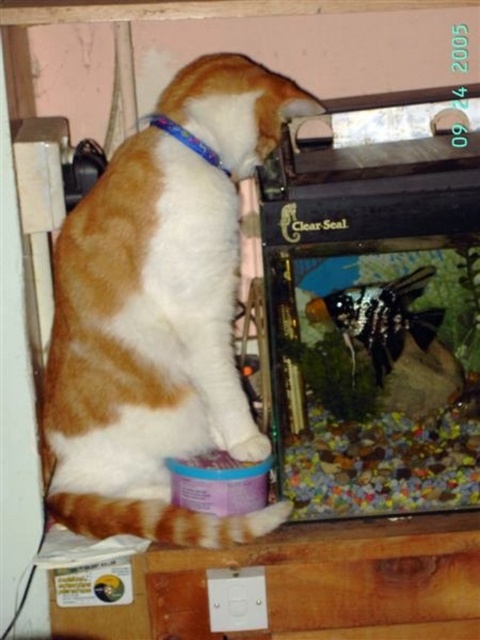
Question: Observing the image, what is the correct spatial positioning of orange and white fur cat at center in reference to black glossy fish at center?

Choices:
 (A) left
 (B) right

Answer: (A)

Question: Which point is farther to the camera?

Choices:
 (A) black glossy fish at center
 (B) orange and white fur cat at center

Answer: (A)

Question: Which point appears closest to the camera in this image?

Choices:
 (A) (115, 448)
 (B) (337, 292)

Answer: (A)

Question: Among these objects, which one is nearest to the camera?

Choices:
 (A) orange and white fur cat at center
 (B) black glossy fish at center

Answer: (A)

Question: Can you confirm if orange and white fur cat at center is positioned below black glossy fish at center?

Choices:
 (A) yes
 (B) no

Answer: (B)

Question: Does orange and white fur cat at center appear under black glossy fish at center?

Choices:
 (A) yes
 (B) no

Answer: (B)